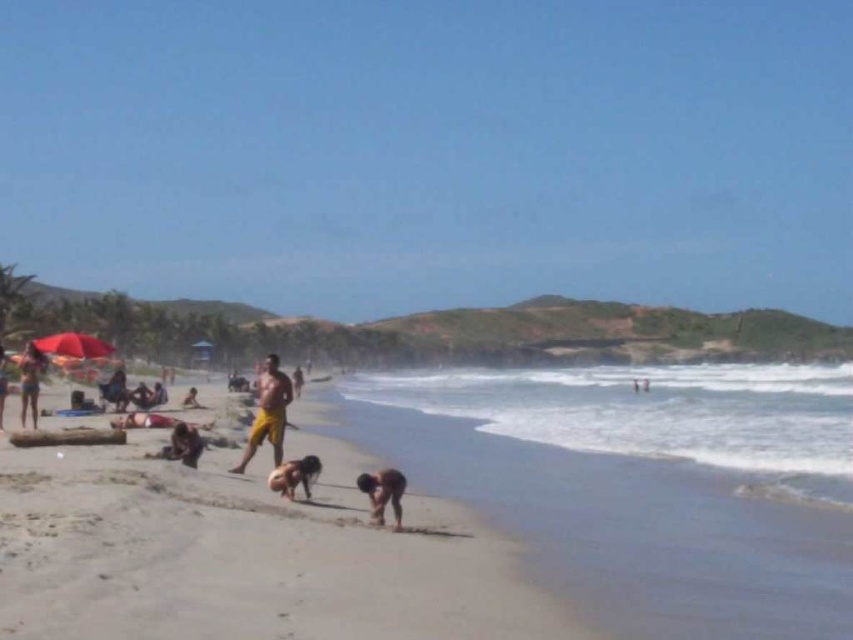
Question: Can you confirm if dark brown skin at lower center is smaller than matte pink bikini at left?

Choices:
 (A) yes
 (B) no

Answer: (A)

Question: Which point is farther to the camera?

Choices:
 (A) coord(276,417)
 (B) coord(25,413)
 (C) coord(184,422)

Answer: (B)

Question: Considering the real-world distances, which object is farthest from the matte pink bikini at left?

Choices:
 (A) yellow fabric person at center
 (B) dark brown skin at lower center
 (C) brown fur dog at lower center

Answer: (B)

Question: Is light brown sand at center bigger than brown fur dog at lower center?

Choices:
 (A) yes
 (B) no

Answer: (A)

Question: Which object appears farthest from the camera in this image?

Choices:
 (A) brown fur dog at lower center
 (B) yellow fabric person at center
 (C) dark brown skin at lower center
 (D) light brown sand at center

Answer: (B)

Question: Is dark brown skin at lower center behind brown fur dog at lower center?

Choices:
 (A) yes
 (B) no

Answer: (B)